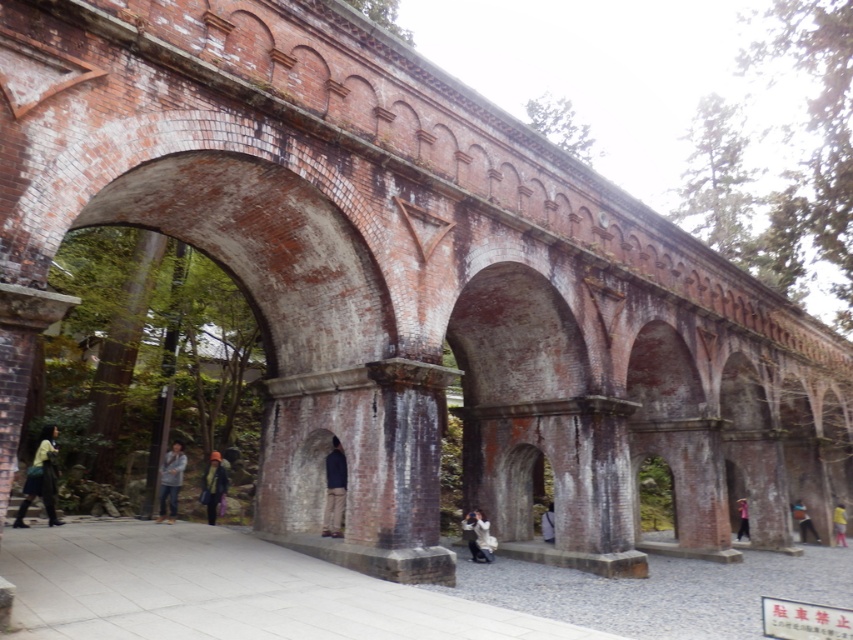
Based on the photo, between light brown leather jacket at lower center and orange knit hat at center, which one is positioned higher?

Positioned higher is light brown leather jacket at lower center.

Which is behind, point (163, 502) or point (201, 490)?

The point (201, 490) is more distant.

What do you see at coordinates (170, 481) in the screenshot?
I see `light brown leather jacket at lower center` at bounding box center [170, 481].

What are the coordinates of `light brown leather jacket at lower center` in the screenshot? It's located at (170, 481).

Which of these two, dark blue jacket at center or light brown leather jacket at lower center, stands taller?

light brown leather jacket at lower center

Based on the photo, how distant is dark blue jacket at center from light brown leather jacket at lower center?

dark blue jacket at center and light brown leather jacket at lower center are 16.34 meters apart from each other.

Image resolution: width=853 pixels, height=640 pixels. Identify the location of dark blue jacket at center. (334, 490).

The image size is (853, 640). In order to click on dark blue jacket at center in this screenshot , I will do `click(334, 490)`.

Which of these two, dark blue jacket at center or pink fabric at lower right, stands taller?

Standing taller between the two is pink fabric at lower right.

Does dark blue jacket at center appear on the left side of pink fabric at lower right?

Indeed, dark blue jacket at center is positioned on the left side of pink fabric at lower right.

You are a GUI agent. You are given a task and a screenshot of the screen. Output one action in this format:
    pyautogui.click(x=<x>, y=<y>)
    Task: Click on the dark blue jacket at center
    The image size is (853, 640).
    Given the screenshot: What is the action you would take?
    pyautogui.click(x=334, y=490)